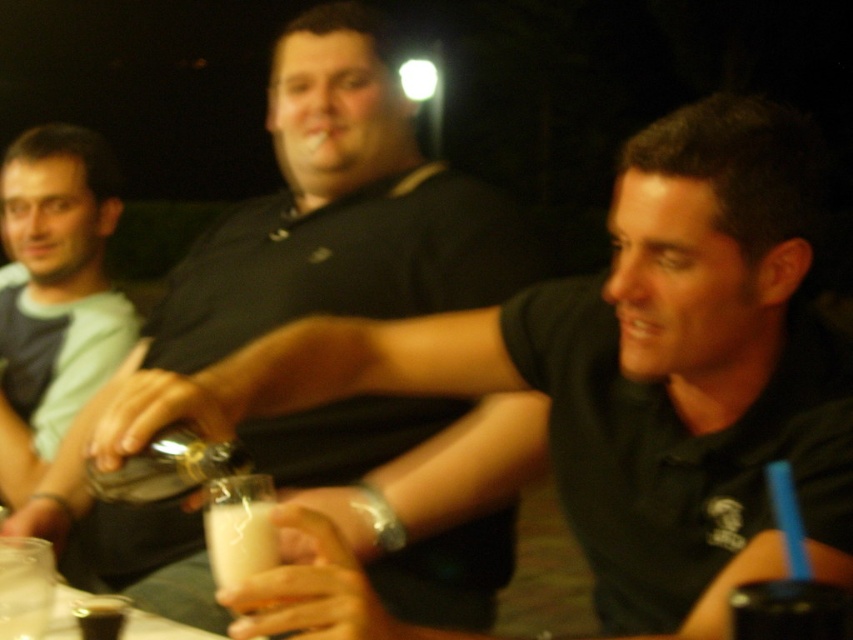
You are a delivery robot that needs to place a package between the light blue cotton shirt at left and the black plastic cup at lower right. The package is 1.5 meters long. Can you fit it in the space between them?

The distance between the light blue cotton shirt at left and the black plastic cup at lower right is 1.64 meters. Since the package is 1.5 meters long, it can fit in the space between them as there is enough room.

Based on the scene description and the coordinates provided, which object corresponds to the point marked at coordinates (299, 272)?

The point marked at coordinates (299, 272) corresponds to the matte black shirt at center.